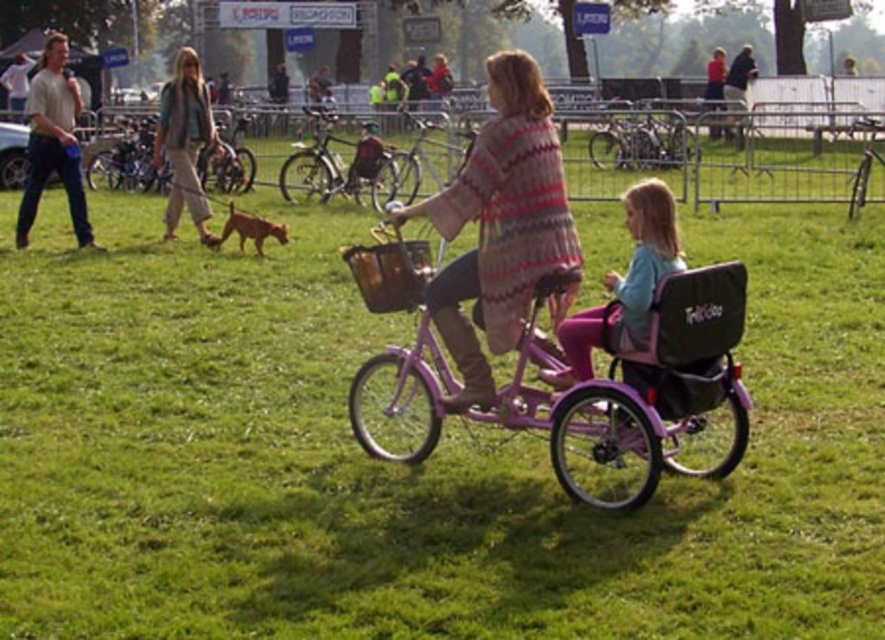
Question: Considering the real-world distances, which object is farthest from the light brown fabric jacket at upper left?

Choices:
 (A) purple matte tricycle at center
 (B) light blue fabric child at center

Answer: (B)

Question: Is knitted sweater at center to the left of metallic silver bicycle at center from the viewer's perspective?

Choices:
 (A) no
 (B) yes

Answer: (B)

Question: Does light brown fabric jacket at upper left appear under silver metallic bicycle at right?

Choices:
 (A) no
 (B) yes

Answer: (A)

Question: Which of these objects is positioned closest to the matte black basket at center?

Choices:
 (A) knitted sweater at center
 (B) metallic silver bicycle at center
 (C) purple matte tricycle at center

Answer: (C)

Question: Which object is farther from the camera taking this photo?

Choices:
 (A) metallic silver bicycle at center
 (B) pink matte bicycle at center
 (C) light blue fabric child at center

Answer: (A)

Question: Does matte black basket at center have a smaller size compared to silver metallic bicycle at right?

Choices:
 (A) yes
 (B) no

Answer: (A)